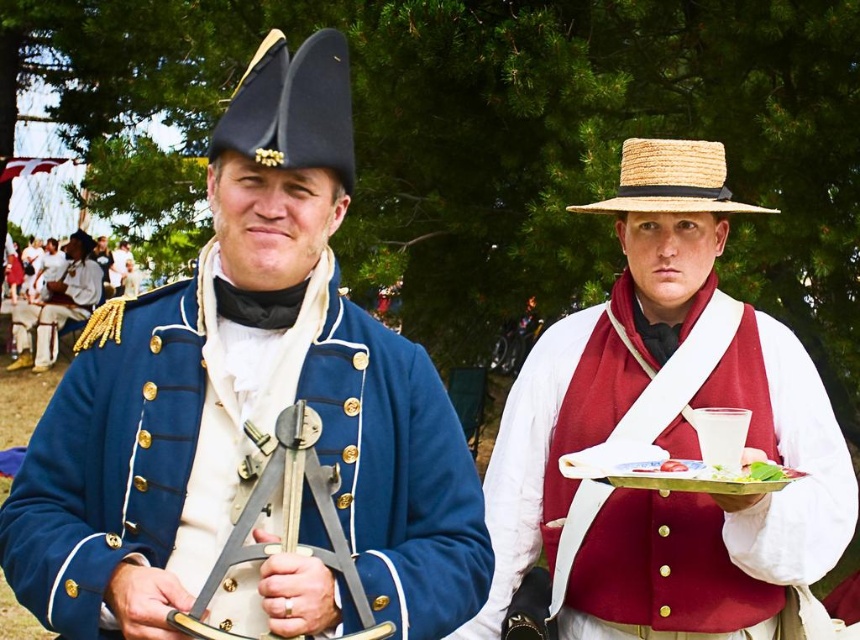
You are an observer standing in front of the scene described. Which object is positioned closer to you between the blue woolen coat at center and the matte straw hat at center?

The blue woolen coat at center is closer to the viewer than the matte straw hat at center.

You are a photographer at a historical reenactment event. You need to capture a closeup shot of both the matte black tricorn hat at upper left and the white paper plate at center. However, your camera lens can only focus on objects within a 10 cm height range. Given their height relationship, will you be able to focus on both objects simultaneously?

The matte black tricorn hat at upper left is taller than the white paper plate at center. Since the height difference between them is not specified, but the question states the camera can focus within a 10 cm height range, it is possible if their height difference is less than or equal to 10 cm. However, without exact measurements, we cannot confirm for certain.